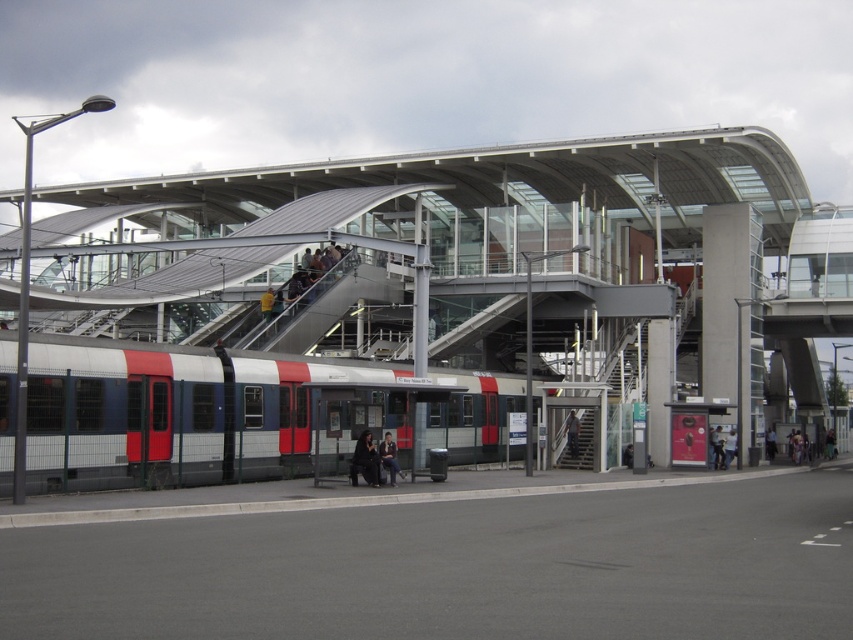
You are standing at the entrance of the train station and want to board the red and white metal train at center. Based on the coordinates provided, in which direction should you walk to reach the train?

The red and white metal train at center is located at coordinates point [239,413], which means you should walk towards the center of the station to reach it.